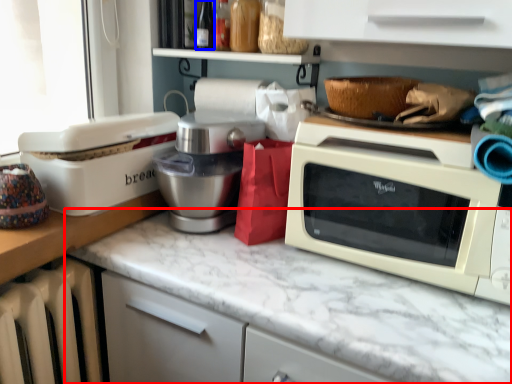
Question: Among these objects, which one is farthest to the camera, countertop (highlighted by a red box) or bottle (highlighted by a blue box)?

Choices:
 (A) countertop
 (B) bottle

Answer: (B)